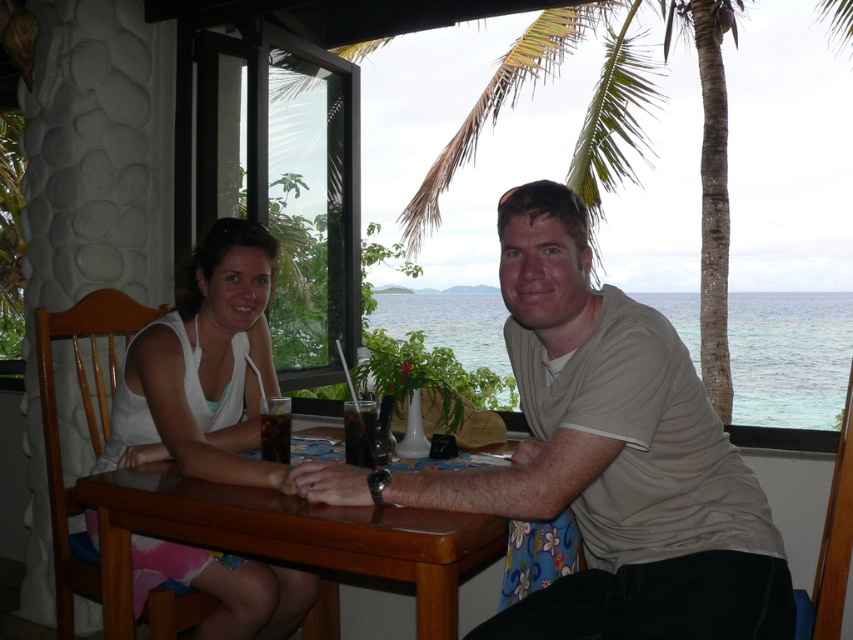
Question: Which object appears closest to the camera in this image?

Choices:
 (A) translucent glass drink at table center
 (B) translucent glass cup at table center
 (C) light beige t-shirt at center
 (D) brown polished wood table at center

Answer: (C)

Question: Is white fabric dress at center wider than translucent glass cup at table center?

Choices:
 (A) yes
 (B) no

Answer: (A)

Question: Can you confirm if light beige t-shirt at center is positioned to the left of translucent glass drink at table center?

Choices:
 (A) no
 (B) yes

Answer: (A)

Question: Does translucent glass drink at table center appear under translucent glass cup at table center?

Choices:
 (A) no
 (B) yes

Answer: (B)

Question: Which of the following is the farthest from the observer?

Choices:
 (A) (277, 419)
 (B) (357, 456)
 (C) (589, 577)

Answer: (A)

Question: Among these points, which one is nearest to the camera?

Choices:
 (A) (675, 488)
 (B) (277, 408)
 (C) (392, 566)
 (D) (218, 637)

Answer: (C)